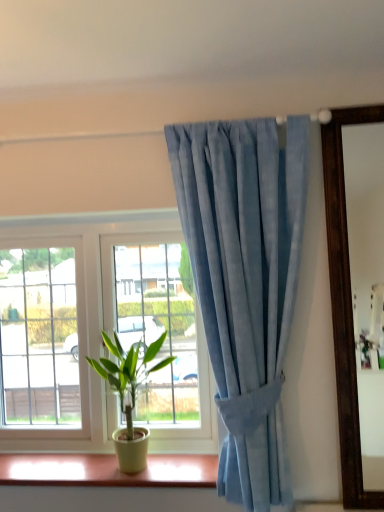
Question: Is matte yellow plastic at lower center in front of light blue fabric curtain at upper center?

Choices:
 (A) no
 (B) yes

Answer: (A)

Question: Is matte yellow plastic at lower center positioned far away from light blue fabric curtain at upper center?

Choices:
 (A) yes
 (B) no

Answer: (B)

Question: Considering the relative sizes of matte yellow plastic at lower center and light blue fabric curtain at upper center in the image provided, is matte yellow plastic at lower center wider than light blue fabric curtain at upper center?

Choices:
 (A) yes
 (B) no

Answer: (A)

Question: Can you confirm if matte yellow plastic at lower center is thinner than light blue fabric curtain at upper center?

Choices:
 (A) yes
 (B) no

Answer: (B)

Question: Is matte yellow plastic at lower center oriented towards light blue fabric curtain at upper center?

Choices:
 (A) yes
 (B) no

Answer: (B)

Question: From a real-world perspective, is matte yellow plastic at lower center over light blue fabric curtain at upper center?

Choices:
 (A) no
 (B) yes

Answer: (A)

Question: From the image's perspective, is green matte plant at lower left located beneath light blue fabric curtain at upper center?

Choices:
 (A) no
 (B) yes

Answer: (B)

Question: From a real-world perspective, is green matte plant at lower left beneath light blue fabric curtain at upper center?

Choices:
 (A) no
 (B) yes

Answer: (B)

Question: Is green matte plant at lower left at the left side of light blue fabric curtain at upper center?

Choices:
 (A) yes
 (B) no

Answer: (A)

Question: Is green matte plant at lower left surrounding light blue fabric curtain at upper center?

Choices:
 (A) yes
 (B) no

Answer: (B)

Question: Considering the relative sizes of green matte plant at lower left and light blue fabric curtain at upper center in the image provided, is green matte plant at lower left taller than light blue fabric curtain at upper center?

Choices:
 (A) yes
 (B) no

Answer: (B)

Question: Can we say green matte plant at lower left lies outside light blue fabric curtain at upper center?

Choices:
 (A) yes
 (B) no

Answer: (A)

Question: From the image's perspective, is light blue fabric curtain at upper center located beneath matte yellow plastic at lower center?

Choices:
 (A) yes
 (B) no

Answer: (B)